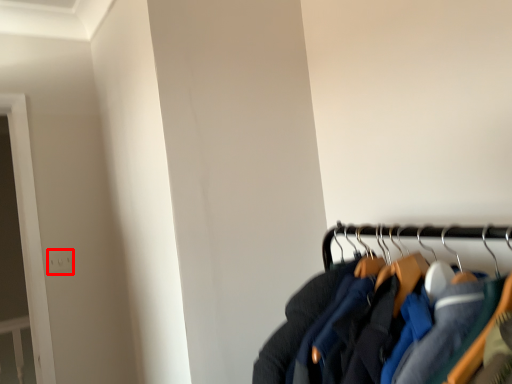
Question: From the image, what is the correct spatial relationship of electric outlet (annotated by the red box) in relation to jacket?

Choices:
 (A) right
 (B) left

Answer: (B)